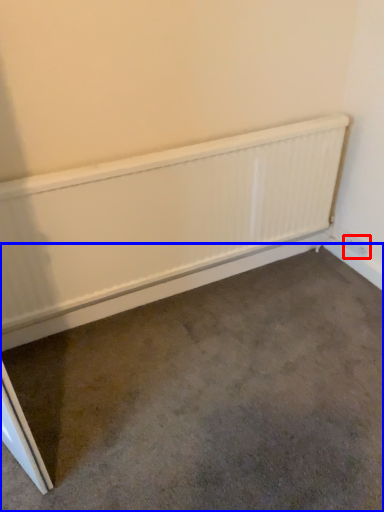
Question: Which point is further to the camera, electric outlet (highlighted by a red box) or concrete (highlighted by a blue box)?

Choices:
 (A) electric outlet
 (B) concrete

Answer: (A)